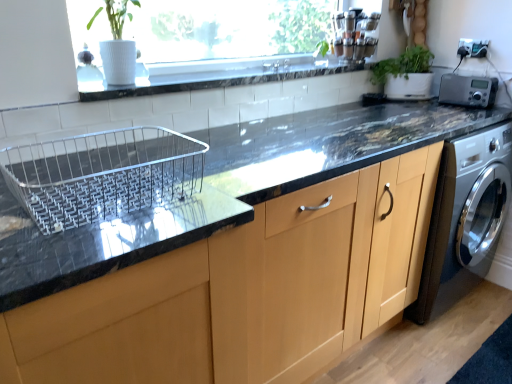
Find the location of a particular element. The width and height of the screenshot is (512, 384). vacant space underneath silver metallic radio at upper right (from a real-world perspective) is located at coordinates pos(471,103).